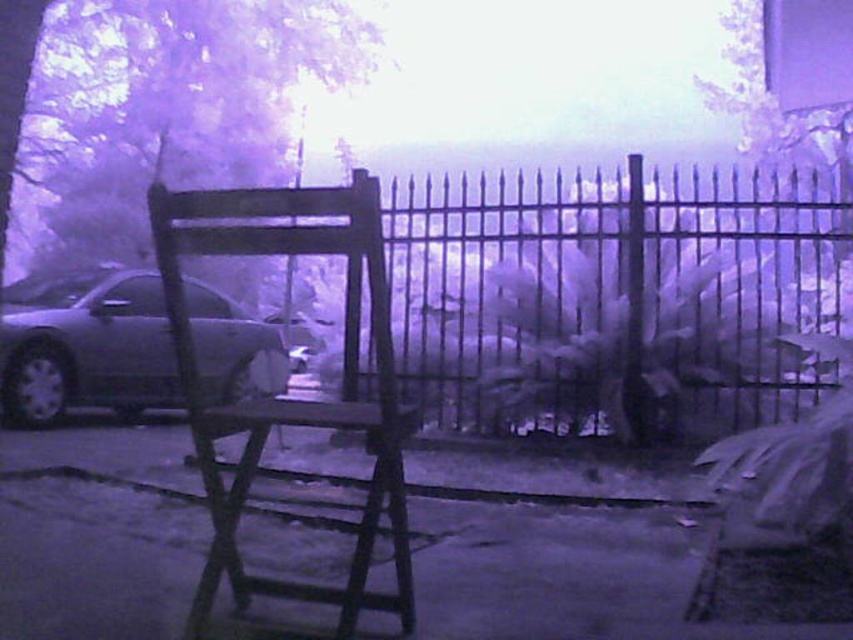
Question: Which object is closer to the camera taking this photo?

Choices:
 (A) wooden chair at center
 (B) purple frosted tree at upper left
 (C) satin silver car at left
 (D) black metal fence at center

Answer: (A)

Question: Can you confirm if wooden chair at center is wider than satin silver car at left?

Choices:
 (A) no
 (B) yes

Answer: (A)

Question: Considering the relative positions of black metal fence at center and purple frosted tree at upper left in the image provided, where is black metal fence at center located with respect to purple frosted tree at upper left?

Choices:
 (A) above
 (B) below

Answer: (B)

Question: In this image, where is purple frosted tree at upper left located relative to satin silver car at left?

Choices:
 (A) left
 (B) right

Answer: (B)

Question: Which of the following is the farthest from the observer?

Choices:
 (A) (38, 308)
 (B) (125, 1)
 (C) (392, 488)

Answer: (B)

Question: Which point appears closest to the camera in this image?

Choices:
 (A) (93, 292)
 (B) (363, 211)

Answer: (B)